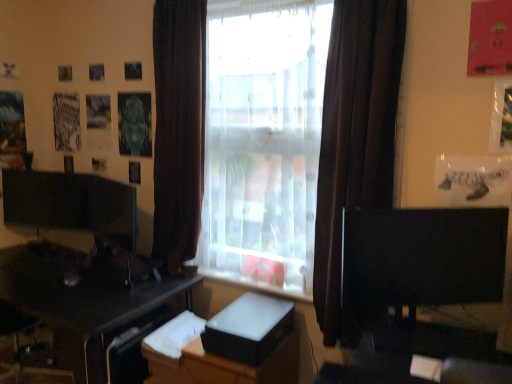
This screenshot has height=384, width=512. What do you see at coordinates (214, 359) in the screenshot?
I see `white glossy dresser at center` at bounding box center [214, 359].

The image size is (512, 384). Describe the element at coordinates (355, 140) in the screenshot. I see `translucent fabric window at center` at that location.

The image size is (512, 384). What do you see at coordinates (355, 141) in the screenshot?
I see `brown fabric curtain at right, arranged as the first curtain when viewed from the right` at bounding box center [355, 141].

Describe the element at coordinates (178, 129) in the screenshot. Image resolution: width=512 pixels, height=384 pixels. I see `brown fabric curtain at center, which ranks as the 1th curtain in left-to-right order` at that location.

The width and height of the screenshot is (512, 384). I want to click on matte black monitor at left, marked as the first computer monitor in a left-to-right arrangement, so click(x=109, y=210).

Identify the location of white glossy dresser at center. The image size is (512, 384). (214, 359).

Looking at this image, is black glossy desk at lower left completely or partially outside of transparent glass window at center?

Yes, black glossy desk at lower left is not within transparent glass window at center.

Can you confirm if black glossy desk at lower left is taller than transparent glass window at center?

In fact, black glossy desk at lower left may be shorter than transparent glass window at center.

Based on the photo, is black glossy desk at lower left oriented towards transparent glass window at center?

No, black glossy desk at lower left is not aimed at transparent glass window at center.

Who is taller, black glossy desk at lower left or white glossy dresser at center?

Standing taller between the two is black glossy desk at lower left.

The height and width of the screenshot is (384, 512). What are the coordinates of `dresser located on the right of black glossy desk at lower left` in the screenshot? It's located at (214, 359).

Considering the positions of objects black glossy desk at lower left and white glossy dresser at center in the image provided, who is more to the right, black glossy desk at lower left or white glossy dresser at center?

Positioned to the right is white glossy dresser at center.

Is black glossy desk at lower left facing away from white glossy dresser at center?

black glossy desk at lower left is not turned away from white glossy dresser at center.

From the image's perspective, is white matte cardboard box at center located above or below brown fabric curtain at center, which ranks as the 1th curtain in left-to-right order?

white matte cardboard box at center is situated lower than brown fabric curtain at center, which ranks as the 1th curtain in left-to-right order, in the image.

Which of these two, white matte cardboard box at center or brown fabric curtain at center, which ranks as the 1th curtain in left-to-right order, is thinner?

brown fabric curtain at center, which ranks as the 1th curtain in left-to-right order.

In terms of size, does white matte cardboard box at center appear bigger or smaller than brown fabric curtain at center, which ranks as the 1th curtain in left-to-right order?

In the image, white matte cardboard box at center appears to be smaller than brown fabric curtain at center, which ranks as the 1th curtain in left-to-right order.

Does point (251, 349) appear closer or farther from the camera than point (175, 36)?

Point (251, 349) is closer to the camera than point (175, 36).

Considering the positions of point (382, 206) and point (254, 263), is point (382, 206) closer or farther from the camera than point (254, 263)?

Point (382, 206) appears to be closer to the viewer than point (254, 263).

Is brown fabric curtain at right, which is counted as the 2th curtain, starting from the left, bigger or smaller than transparent glass window at center?

brown fabric curtain at right, which is counted as the 2th curtain, starting from the left, is smaller than transparent glass window at center.

Which object is thinner, brown fabric curtain at right, arranged as the first curtain when viewed from the right, or transparent glass window at center?

transparent glass window at center is thinner.

Between brown fabric curtain at right, which is counted as the 2th curtain, starting from the left, and transparent glass window at center, which one is positioned behind?

transparent glass window at center.

Is point (164, 83) less distant than point (262, 71)?

No, it is not.

From a real-world perspective, which object rests below the other?

transparent glass window at center.

From the picture: Who is smaller, brown fabric curtain at center, which appears as the 2th curtain when viewed from the right, or transparent glass window at center?

transparent glass window at center.

In the image, is translucent fabric window at center positioned in front of or behind matte black monitor at left, arranged as the second computer monitor when viewed from the right?

In the image, translucent fabric window at center appears in front of matte black monitor at left, arranged as the second computer monitor when viewed from the right.

Between translucent fabric window at center and matte black monitor at left, arranged as the second computer monitor when viewed from the right, which one has larger size?

translucent fabric window at center.

From a real-world perspective, between translucent fabric window at center and matte black monitor at left, marked as the first computer monitor in a left-to-right arrangement, who is vertically higher?

translucent fabric window at center, from a real-world perspective.

How different are the orientations of brown fabric curtain at center, which appears as the 2th curtain when viewed from the right, and black glossy desk at lower left in degrees?

The angle between the facing direction of brown fabric curtain at center, which appears as the 2th curtain when viewed from the right, and the facing direction of black glossy desk at lower left is 0.0759 degrees.

Is brown fabric curtain at center, which ranks as the 1th curtain in left-to-right order, in front of or behind black glossy desk at lower left in the image?

brown fabric curtain at center, which ranks as the 1th curtain in left-to-right order, is positioned farther from the viewer than black glossy desk at lower left.

How much distance is there between brown fabric curtain at center, which appears as the 2th curtain when viewed from the right, and black glossy desk at lower left?

They are 23.05 inches apart.

Who is smaller, brown fabric curtain at center, which appears as the 2th curtain when viewed from the right, or black glossy desk at lower left?

With smaller size is brown fabric curtain at center, which appears as the 2th curtain when viewed from the right.

This screenshot has width=512, height=384. I want to click on desk that is under the transparent glass window at center (from a real-world perspective), so click(90, 307).

Find the location of `desk above the white glossy dresser at center (from the image's perspective)`. desk above the white glossy dresser at center (from the image's perspective) is located at coordinates (90, 307).

Looking at the image, which one is located closer to transparent glass window at center, black matte computer monitor at right, acting as the 2th computer monitor starting from the back, or translucent fabric window at center?

translucent fabric window at center lies closer to transparent glass window at center than the other object.

Based on their spatial positions, is black matte computer monitor at right, acting as the 2th computer monitor starting from the back, or black glossy desk at lower left further from matte black monitor at left, marked as the first computer monitor in a left-to-right arrangement?

Among the two, black matte computer monitor at right, acting as the 2th computer monitor starting from the back, is located further to matte black monitor at left, marked as the first computer monitor in a left-to-right arrangement.

Which object lies further to the anchor point black matte computer monitor at right, the 2th computer monitor from the left, white glossy dresser at center or translucent fabric window at center?

white glossy dresser at center is positioned further to the anchor black matte computer monitor at right, the 2th computer monitor from the left.

Considering their positions, is translucent fabric window at center positioned further to black glossy desk at lower left than white matte cardboard box at center?

translucent fabric window at center.

Looking at the image, which one is located further to brown fabric curtain at right, arranged as the first curtain when viewed from the right, black matte computer monitor at right, which appears as the 1th computer monitor when viewed from the right, or white glossy dresser at center?

white glossy dresser at center lies further to brown fabric curtain at right, arranged as the first curtain when viewed from the right, than the other object.

When comparing their distances from transparent glass window at center, does black glossy desk at lower left or black matte computer monitor at right, acting as the first computer monitor starting from the front, seem further?

black glossy desk at lower left lies further to transparent glass window at center than the other object.

When comparing their distances from translucent fabric window at center, does brown fabric curtain at center, which ranks as the 1th curtain in left-to-right order, or white matte cardboard box at center seem closer?

white matte cardboard box at center.

Considering their positions, is black glossy desk at lower left positioned further to brown fabric curtain at center, which appears as the 2th curtain when viewed from the right, than translucent fabric window at center?

Based on the image, translucent fabric window at center appears to be further to brown fabric curtain at center, which appears as the 2th curtain when viewed from the right.

Find the location of a particular element. window between black glossy desk at lower left and transparent glass window at center in the horizontal direction is located at coordinates (355, 140).

Locate an element on the screen. This screenshot has width=512, height=384. cardboard box between brown fabric curtain at center, which ranks as the 1th curtain in left-to-right order, and black glossy desk at lower left from top to bottom is located at coordinates (249, 329).

You are a GUI agent. You are given a task and a screenshot of the screen. Output one action in this format:
    pyautogui.click(x=<x>, y=<y>)
    Task: Click on the cardboard box situated between black glossy desk at lower left and brown fabric curtain at right, which is counted as the 2th curtain, starting from the left, from left to right
    This screenshot has width=512, height=384.
    Given the screenshot: What is the action you would take?
    pyautogui.click(x=249, y=329)

The image size is (512, 384). Find the location of `computer monitor situated between black glossy desk at lower left and black matte computer monitor at right, acting as the 2th computer monitor starting from the back, from left to right`. computer monitor situated between black glossy desk at lower left and black matte computer monitor at right, acting as the 2th computer monitor starting from the back, from left to right is located at coordinates (109, 210).